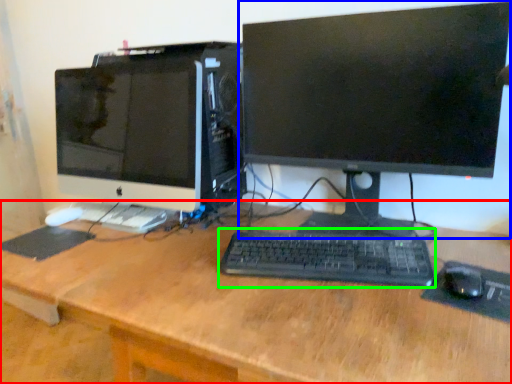
Question: Which object is positioned farthest from desk (highlighted by a red box)? Select from computer monitor (highlighted by a blue box) and computer keyboard (highlighted by a green box).

Choices:
 (A) computer monitor
 (B) computer keyboard

Answer: (A)